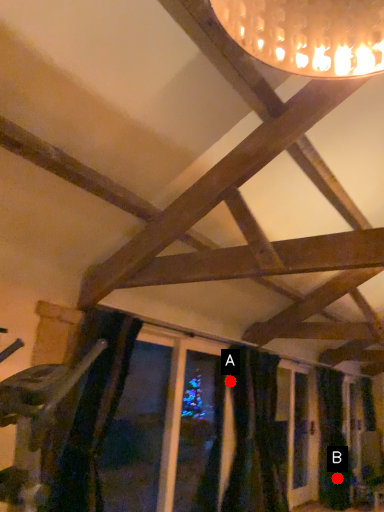
Question: Two points are circled on the image, labeled by A and B beside each circle. Which point is farther from the camera taking this photo?

Choices:
 (A) A is further
 (B) B is further

Answer: (B)